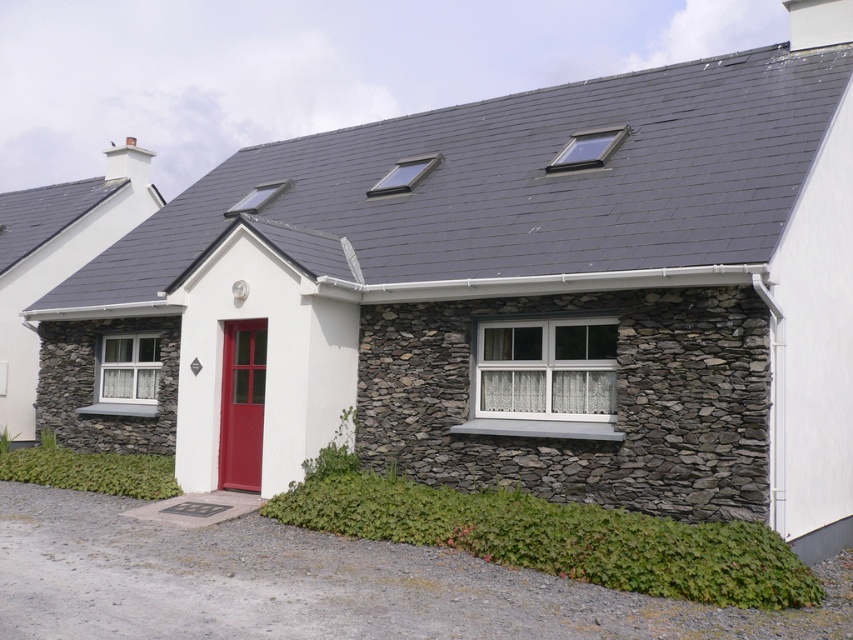
Question: Which of the following is the farthest from the observer?

Choices:
 (A) matte red door at center
 (B) gray gravel driveway at lower left

Answer: (A)

Question: Does gray gravel driveway at lower left appear over white stone wall at upper left?

Choices:
 (A) yes
 (B) no

Answer: (B)

Question: From the image, what is the correct spatial relationship of white stone wall at upper left in relation to matte red door at center?

Choices:
 (A) right
 (B) left

Answer: (B)

Question: Does white stone wall at upper left appear on the right side of matte red door at center?

Choices:
 (A) no
 (B) yes

Answer: (A)

Question: Among these objects, which one is farthest from the camera?

Choices:
 (A) white stone wall at upper left
 (B) matte red door at center

Answer: (A)

Question: Among these points, which one is nearest to the camera?

Choices:
 (A) (224, 486)
 (B) (24, 234)

Answer: (A)